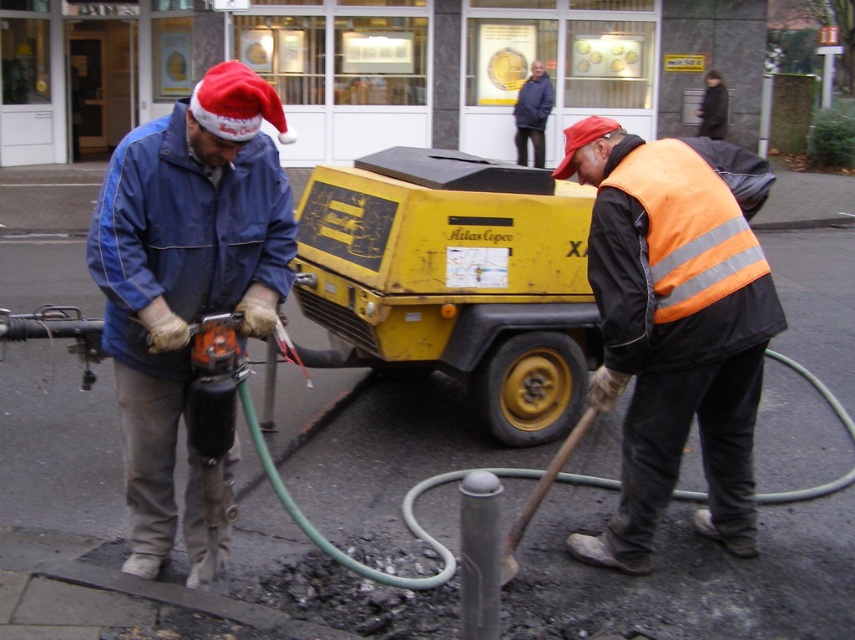
Which of these two, orange reflective vest at center or blue denim jacket at upper center, stands taller?

orange reflective vest at center

Is orange reflective vest at center to the left of blue denim jacket at upper center from the viewer's perspective?

Correct, you'll find orange reflective vest at center to the left of blue denim jacket at upper center.

Who is more distant from viewer, (634, 416) or (532, 68)?

Positioned behind is point (532, 68).

Image resolution: width=855 pixels, height=640 pixels. I want to click on orange reflective vest at center, so click(675, 324).

Who is positioned more to the left, orange reflective vest at center or blue denim jacket at left?

From the viewer's perspective, blue denim jacket at left appears more on the left side.

Can you confirm if orange reflective vest at center is positioned below blue denim jacket at left?

Yes, orange reflective vest at center is below blue denim jacket at left.

Between point (714, 256) and point (167, 182), which one is positioned behind?

The point (714, 256) is more distant.

Image resolution: width=855 pixels, height=640 pixels. I want to click on orange reflective vest at center, so click(x=675, y=324).

Between orange reflective jacket at lower right and blue denim jacket at upper center, which one has less height?

With less height is orange reflective jacket at lower right.

Between point (659, 173) and point (534, 109), which one is positioned in front?

Point (659, 173)

Does point (723, 307) come closer to viewer compared to point (549, 112)?

Yes, point (723, 307) is closer to viewer.

Locate an element on the screen. orange reflective jacket at lower right is located at coordinates (679, 257).